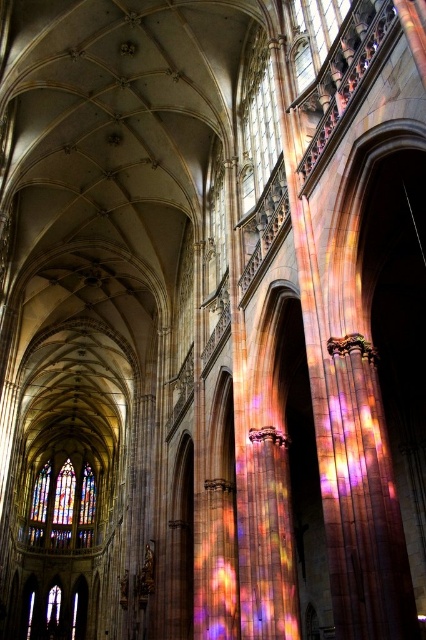
You are an architect visiting the cathedral and want to compare the stained glass window at left and the transparent stained glass at upper center. Which one is taller?

The stained glass window at left is taller than the transparent stained glass at upper center.

You are standing inside the cathedral and want to take a photo of both the stained glass window at left and the transparent stained glass at upper center. Which one will appear larger in your photo?

The stained glass window at left will appear larger in your photo because it is closer to you than the transparent stained glass at upper center.

You are standing in the grand cathedral and want to locate the stained glass window at left. According to the coordinates given, where should you look relative to your position?

The stained glass window at left is located at coordinates point (x=63, y=508), which means it is positioned to the upper left relative to your current position in the cathedral.